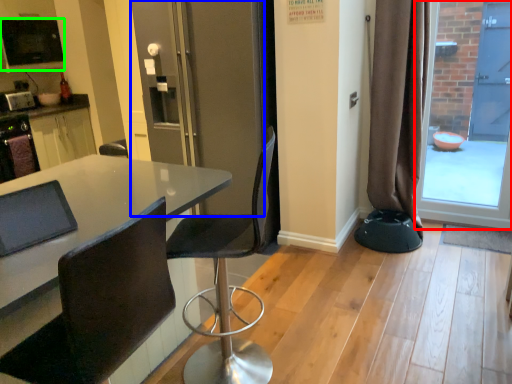
Question: Considering the real-world distances, which object is farthest from glass door (highlighted by a red box)? screen door (highlighted by a blue box) or appliance (highlighted by a green box)?

Choices:
 (A) screen door
 (B) appliance

Answer: (B)